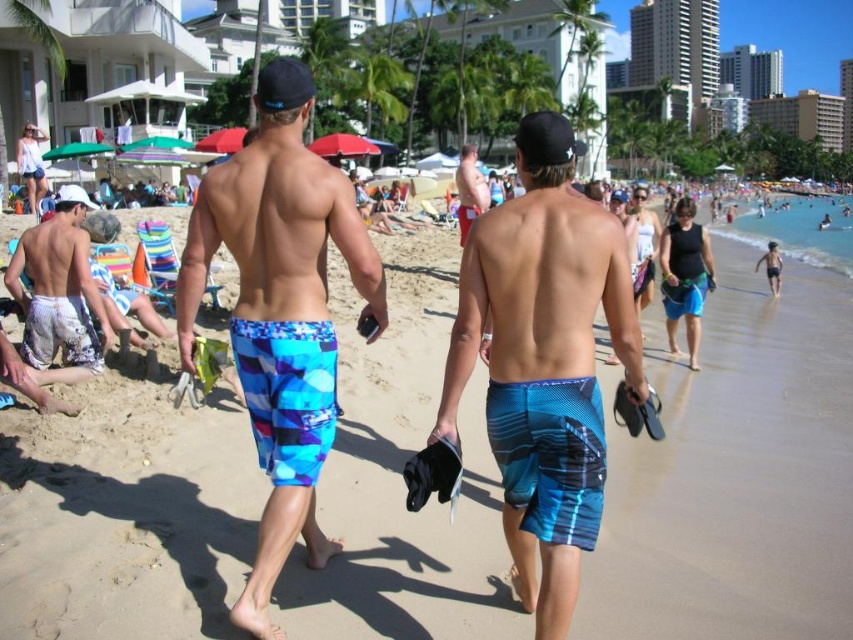
Is blue textured boardshorts at center to the right of white matte shorts at left from the viewer's perspective?

Correct, you'll find blue textured boardshorts at center to the right of white matte shorts at left.

Does point (537, 312) come in front of point (61, 304)?

Yes, point (537, 312) is in front of point (61, 304).

Locate an element on the screen. This screenshot has height=640, width=853. blue textured boardshorts at center is located at coordinates (544, 362).

Identify the location of blue textured boardshorts at center. (544, 362).

Based on the photo, can you confirm if blue textured boardshorts at center is positioned to the right of blue printed boardshorts at center?

Correct, you'll find blue textured boardshorts at center to the right of blue printed boardshorts at center.

Between blue textured boardshorts at center and blue printed boardshorts at center, which one is positioned higher?

blue printed boardshorts at center

Where is `blue textured boardshorts at center`? This screenshot has height=640, width=853. blue textured boardshorts at center is located at coordinates (544, 362).

Can you confirm if blue plaid shorts at center is bigger than blue textured boardshorts at center?

Correct, blue plaid shorts at center is larger in size than blue textured boardshorts at center.

Is blue plaid shorts at center behind blue textured boardshorts at center?

Yes, blue plaid shorts at center is behind blue textured boardshorts at center.

Who is more forward, [132,392] or [598,529]?

Point [598,529] is more forward.

The image size is (853, 640). What are the coordinates of `blue plaid shorts at center` in the screenshot? It's located at (735, 474).